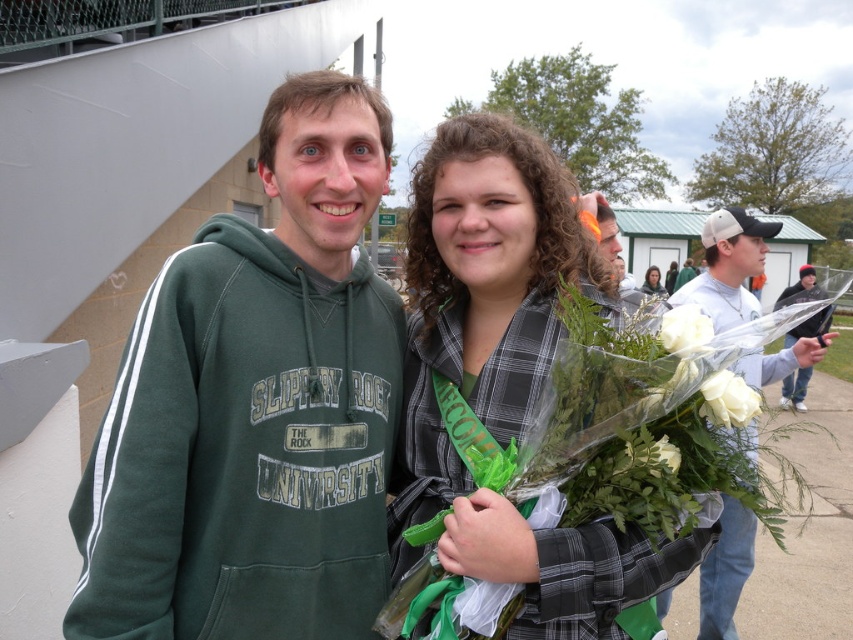
Question: Is white matte bouquet at center further to the viewer compared to green plaid scarf at center?

Choices:
 (A) yes
 (B) no

Answer: (B)

Question: Which of the following is the farthest from the observer?

Choices:
 (A) white silk flower at center
 (B) white matte bouquet at right
 (C) white matte rose at center
 (D) matte green hoodie at center

Answer: (D)

Question: Does green hoodie at left have a smaller size compared to matte green hoodie at center?

Choices:
 (A) yes
 (B) no

Answer: (A)

Question: Which of these objects is positioned closest to the white matte rose at center?

Choices:
 (A) denim jacket at center
 (B) white matte bouquet at right

Answer: (B)

Question: Which point is closer to the camera?

Choices:
 (A) white silk flower at center
 (B) green plaid shirt at center

Answer: (A)

Question: Where is white matte rose at center located in relation to matte green hoodie at center in the image?

Choices:
 (A) right
 (B) left

Answer: (B)